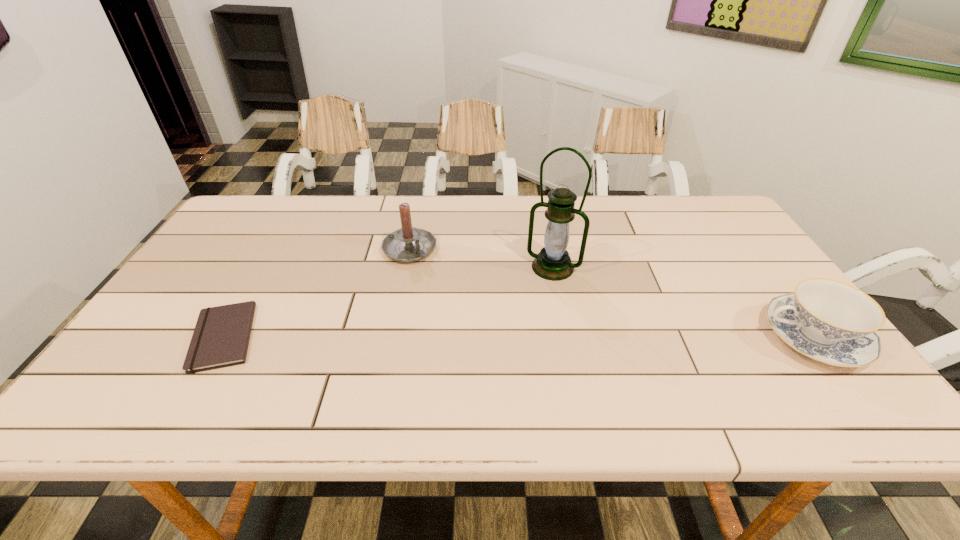
Find the location of a particular element. The image size is (960, 540). unoccupied position between the tallest object and the candle is located at coordinates (481, 258).

Locate an element on the screen. Image resolution: width=960 pixels, height=540 pixels. vacant area between the second shortest object and the lantern is located at coordinates (683, 302).

I want to click on free space between the candle and the tallest object, so click(481, 258).

The width and height of the screenshot is (960, 540). I want to click on unoccupied area between the rightmost object and the checkbook, so click(x=518, y=337).

Identify the location of vacant point located between the second object from left to right and the leftmost object. (317, 293).

Where is `vacant space that's between the second shortest object and the second object from right to left`? This screenshot has width=960, height=540. vacant space that's between the second shortest object and the second object from right to left is located at coordinates (683, 302).

I want to click on empty space that is in between the second object from left to right and the rightmost object, so click(612, 293).

Where is `empty space that is in between the chinaware and the leftmost object`? empty space that is in between the chinaware and the leftmost object is located at coordinates (518, 337).

Identify the location of vacant space in between the candle and the checkbook. (317, 293).

The height and width of the screenshot is (540, 960). In order to click on empty space between the shortest object and the candle in this screenshot , I will do `click(317, 293)`.